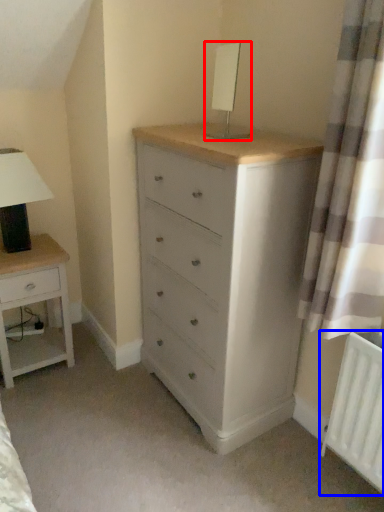
Question: Which of the following is the closest to the observer, table lamp (highlighted by a red box) or radiator (highlighted by a blue box)?

Choices:
 (A) table lamp
 (B) radiator

Answer: (B)